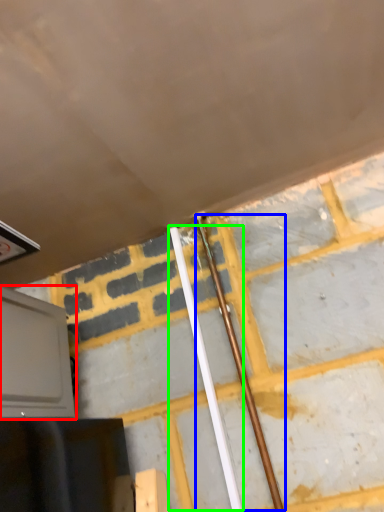
Question: Considering the real-world distances, which object is farthest from oven (highlighted by a red box)? beam (highlighted by a blue box) or beam (highlighted by a green box)?

Choices:
 (A) beam
 (B) beam

Answer: (A)